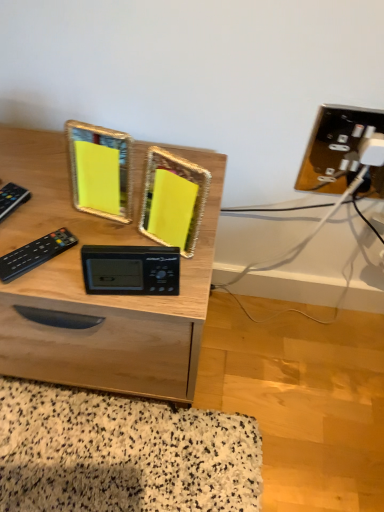
Image resolution: width=384 pixels, height=512 pixels. In order to click on vacant area that lies between black plastic remote at left, which ranks as the second control in right-to-left order, and black plastic remote at left, arranged as the second control when viewed from the left in this screenshot , I will do `click(26, 236)`.